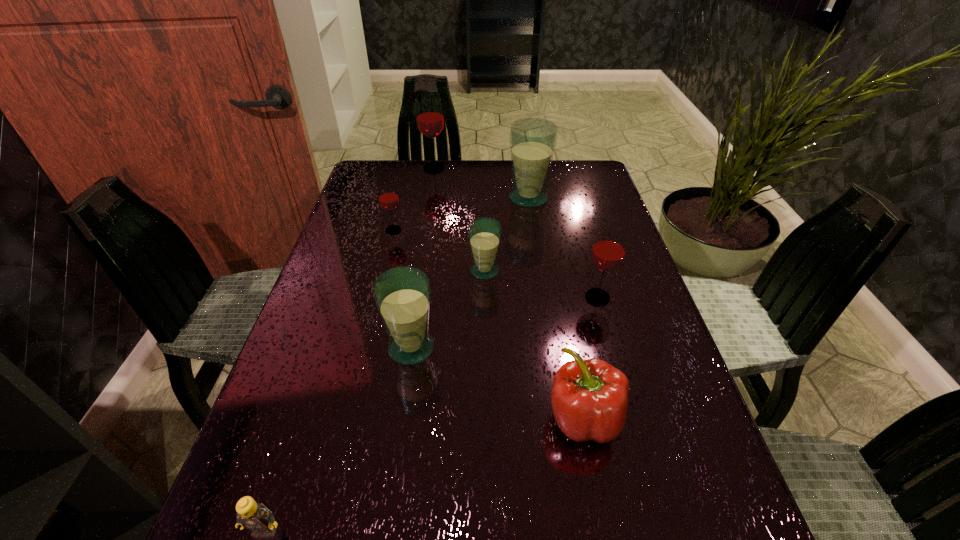
The height and width of the screenshot is (540, 960). I want to click on free location located 0.210m on the right of the fourth farthest object, so click(585, 271).

At what (x,y) coordinates should I click in order to perform the action: click on vacant space located on the front of the smallest red glass. Please return your answer as a coordinate pair (x, y). Looking at the image, I should click on (389, 249).

You are a GUI agent. You are given a task and a screenshot of the screen. Output one action in this format:
    pyautogui.click(x=<x>, y=<y>)
    Task: Click on the free space located 0.240m on the back of the pink pepper
    
    Given the screenshot: What is the action you would take?
    pyautogui.click(x=561, y=299)

The image size is (960, 540). Identify the location of glass that is at the left edge. (388, 198).

Locate an element on the screen. The height and width of the screenshot is (540, 960). Lego that is at the left edge is located at coordinates (257, 518).

Image resolution: width=960 pixels, height=540 pixels. Identify the location of glass positioned at the right edge. (608, 251).

Locate an element on the screen. The image size is (960, 540). pepper situated at the right edge is located at coordinates (589, 398).

In the image, there is a desktop. At what (x,y) coordinates should I click in order to perform the action: click on vacant space at the far edge. Please return your answer as a coordinate pair (x, y). The image size is (960, 540). Looking at the image, I should click on [x=503, y=180].

This screenshot has width=960, height=540. In order to click on free space at the left edge in this screenshot , I will do `click(300, 340)`.

Find the location of a particular element. The width and height of the screenshot is (960, 540). vacant space at the right edge is located at coordinates (617, 217).